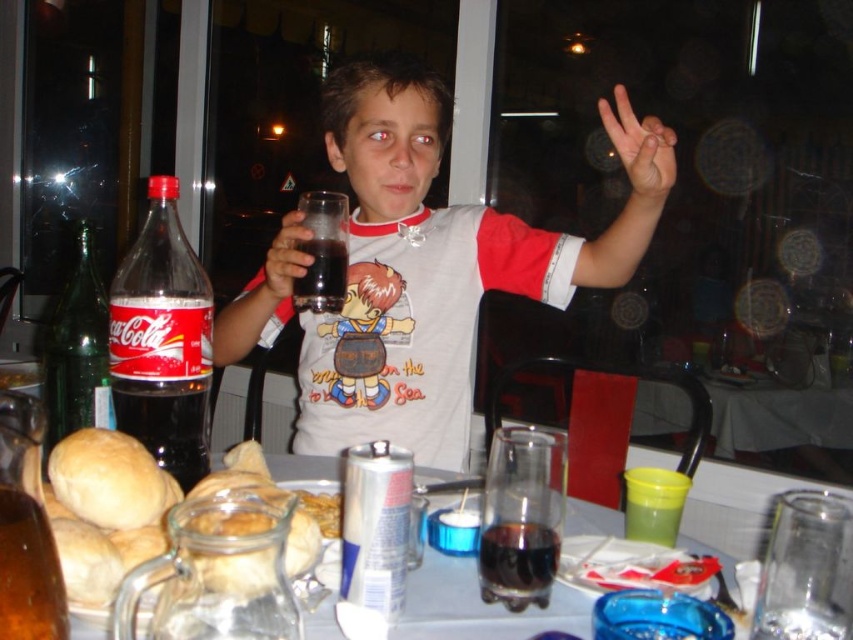
Consider the image. Is golden bread rolls at lower left above matte skin hand at upper right?

No.

Is golden bread rolls at lower left positioned before matte skin hand at upper right?

Yes, it is in front of matte skin hand at upper right.

Looking at this image, who is more distant from viewer, (291, 570) or (657, 193)?

Positioned behind is point (657, 193).

At what (x,y) coordinates should I click in order to perform the action: click on golden bread rolls at lower left. Please return your answer as a coordinate pair (x, y). Looking at the image, I should click on (120, 504).

This screenshot has width=853, height=640. I want to click on matte black glass at center, so click(425, 269).

Is matte black glass at center to the left of golden bread rolls at lower left from the viewer's perspective?

No, matte black glass at center is not to the left of golden bread rolls at lower left.

Who is more forward, (425, 396) or (125, 506)?

Point (125, 506) is more forward.

The image size is (853, 640). I want to click on matte black glass at center, so click(x=425, y=269).

Based on the photo, does green glass bottle at left appear on the left side of matte skin hand at upper right?

Indeed, green glass bottle at left is positioned on the left side of matte skin hand at upper right.

How distant is green glass bottle at left from matte skin hand at upper right?

The distance of green glass bottle at left from matte skin hand at upper right is 25.59 inches.

I want to click on green glass bottle at left, so click(x=77, y=349).